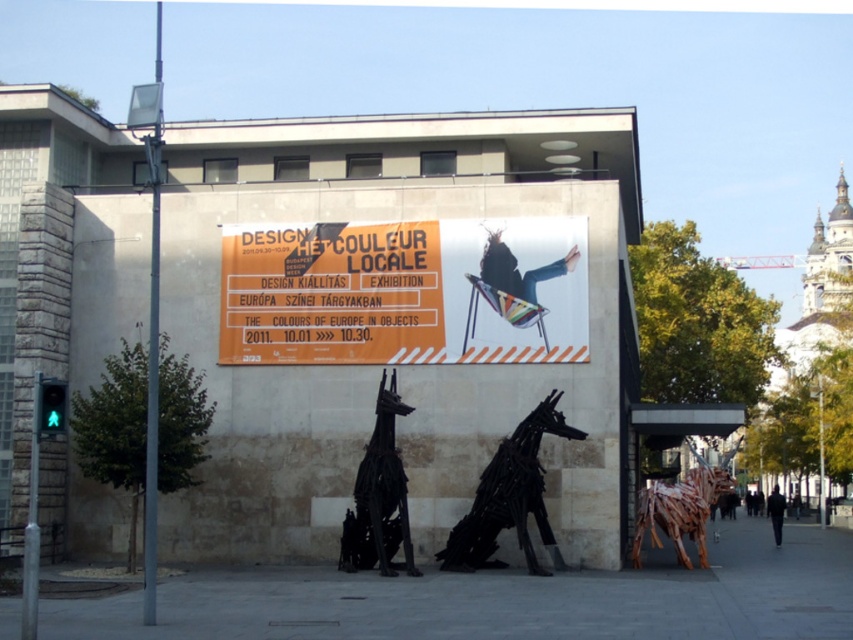
Does black metal sculpture at center have a greater height compared to metallic silver skateboard at upper center?

Yes.

Does point (364, 452) lie behind point (498, 282)?

No, (364, 452) is in front of (498, 282).

Describe the element at coordinates (379, 497) in the screenshot. I see `black metal sculpture at center` at that location.

Identify the location of black metal sculpture at center. point(379,497).

Who is more forward, [695,524] or [537,273]?

Positioned in front is point [537,273].

Does wooden sculpture at lower right have a lesser width compared to metallic silver skateboard at upper center?

No.

Which is behind, point (672, 522) or point (554, 268)?

The point (672, 522) is behind.

Identify the location of wooden sculpture at lower right. The height and width of the screenshot is (640, 853). (679, 512).

Is point (456, 563) behind point (640, 516)?

No, (456, 563) is in front of (640, 516).

Is black wire dog at center in front of wooden sculpture at lower right?

Yes.

At what (x,y) coordinates should I click in order to perform the action: click on black wire dog at center. Please return your answer as a coordinate pair (x, y). Looking at the image, I should click on (509, 497).

Locate an element on the screen. The image size is (853, 640). black wire dog at center is located at coordinates (509, 497).